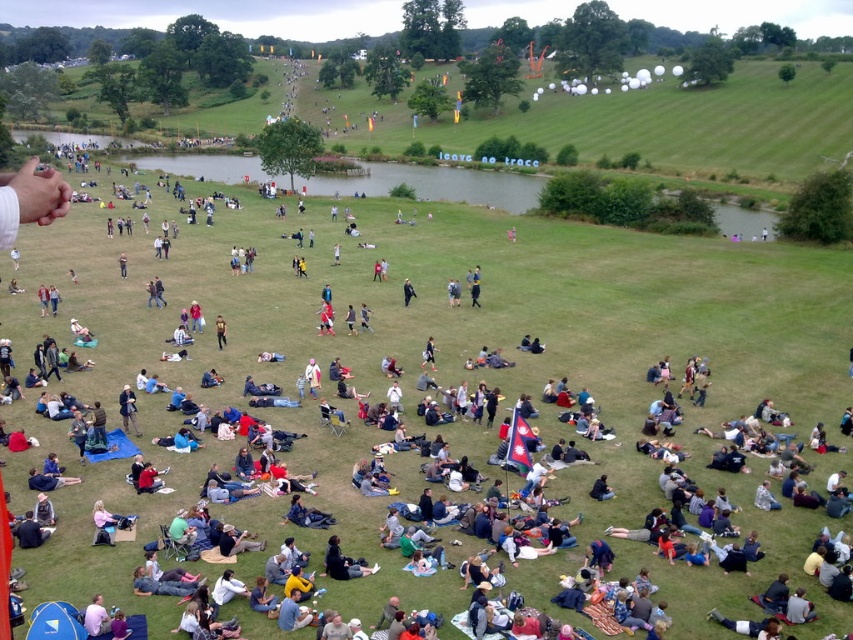
You are a photographer standing at the edge of the field, wanting to capture both the dark blue fabric jacket at center and the brown leather jacket at center in a single wide shot. Given that your camera has a maximum focal length that allows capturing subjects up to 10 meters apart, will you be able to include both jackets in the frame?

The distance between the dark blue fabric jacket at center and the brown leather jacket at center is 10.87 meters. Since your camera can only capture up to 10 meters, you won need to move closer or adjust your position to ensure both jackets fit within the frame.

You are standing at the edge of the field and see both the dark blue fabric jacket at center and the brown leather jacket at center. Which jacket is closer to you?

The dark blue fabric jacket at center is closer to you because it is in front of the brown leather jacket at center.

You are standing at the edge of the field and see both the dark blue fabric jacket at center and the brown leather jacket at center. Which jacket is positioned lower in the image?

The dark blue fabric jacket at center is positioned lower in the image because it is located below the brown leather jacket at center.